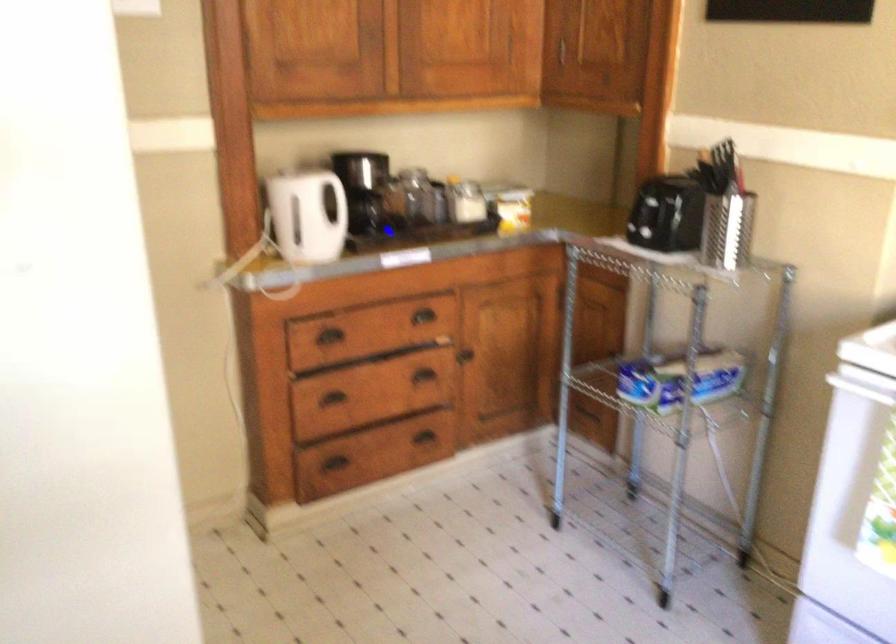
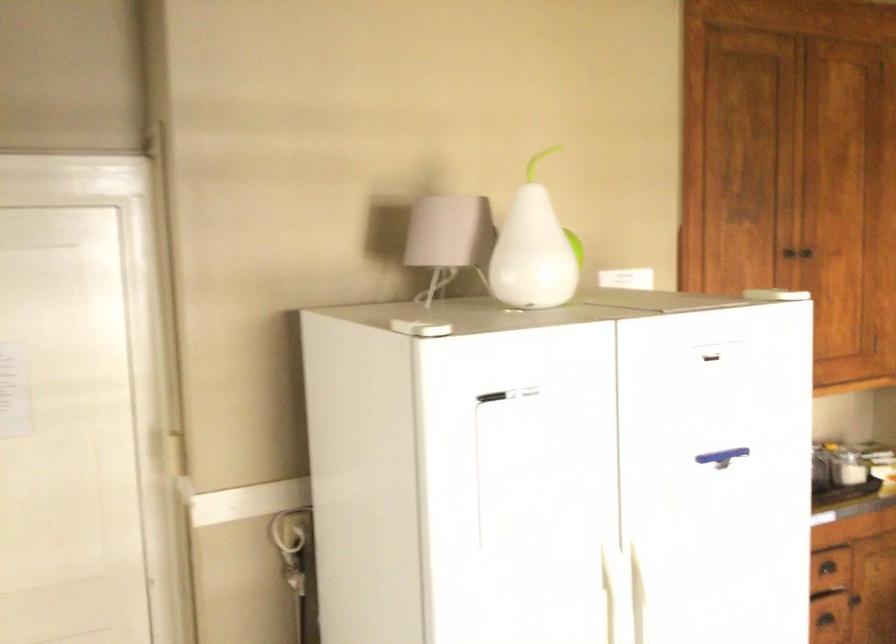
Find the pixel in the second image that matches point 410,292 in the first image.

(826, 567)